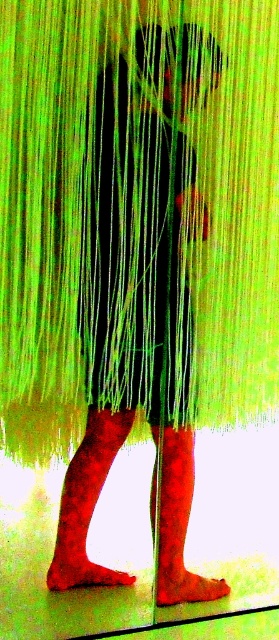
Which is in front, point (85, 445) or point (169, 541)?

Positioned in front is point (169, 541).

Which of these two, velvet red sock at lower left or matte red sock at lower center, stands taller?

velvet red sock at lower left is taller.

Which is in front, point (71, 548) or point (176, 445)?

Point (71, 548) is more forward.

This screenshot has height=640, width=279. I want to click on velvet red sock at lower left, so coord(87,502).

Who is higher up, green string curtain at center or velvet red sock at lower left?

green string curtain at center is higher up.

Is green string curtain at center shorter than velvet red sock at lower left?

No.

Find the location of `green string curtain at center`. green string curtain at center is located at coordinates (80, 204).

Image resolution: width=279 pixels, height=640 pixels. What do you see at coordinates (80, 204) in the screenshot?
I see `green string curtain at center` at bounding box center [80, 204].

Can you confirm if green string curtain at center is shorter than matte red sock at lower center?

No.

Does point (232, 358) lie behind point (160, 570)?

Yes, point (232, 358) is farther from viewer.

The height and width of the screenshot is (640, 279). What are the coordinates of `green string curtain at center` in the screenshot? It's located at (80, 204).